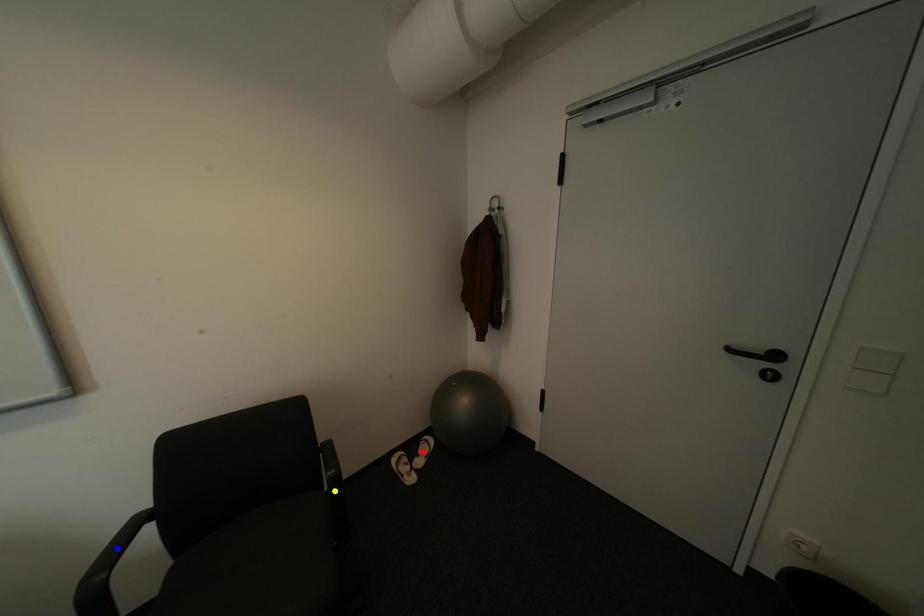
Order these from nearest to farthest:
1. yellow point
2. red point
3. blue point

blue point → yellow point → red point